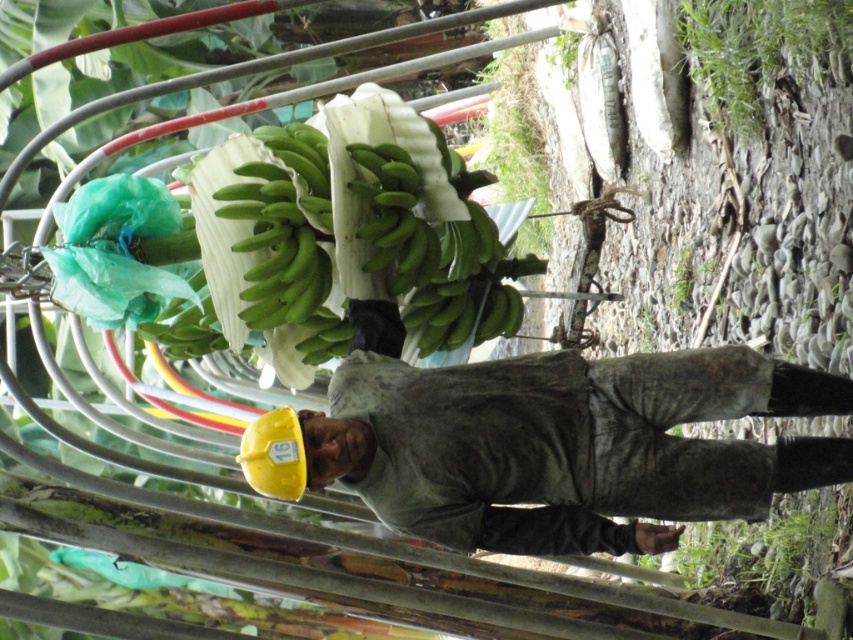
Question: Observing the image, what is the correct spatial positioning of yellow hard hat at center in reference to green matte bananas at center?

Choices:
 (A) right
 (B) left

Answer: (A)

Question: Which of the following is the farthest from the observer?

Choices:
 (A) green matte bananas at center
 (B) yellow hard hat at center

Answer: (A)

Question: From the image, what is the correct spatial relationship of yellow hard hat at center in relation to green matte bananas at center?

Choices:
 (A) below
 (B) above

Answer: (A)

Question: Which of the following is the farthest from the observer?

Choices:
 (A) green matte bananas at center
 (B) yellow hard hat at center

Answer: (A)

Question: Which object is closer to the camera taking this photo?

Choices:
 (A) yellow hard hat at center
 (B) green matte bananas at center

Answer: (A)

Question: Is yellow hard hat at center in front of green matte bananas at center?

Choices:
 (A) yes
 (B) no

Answer: (A)